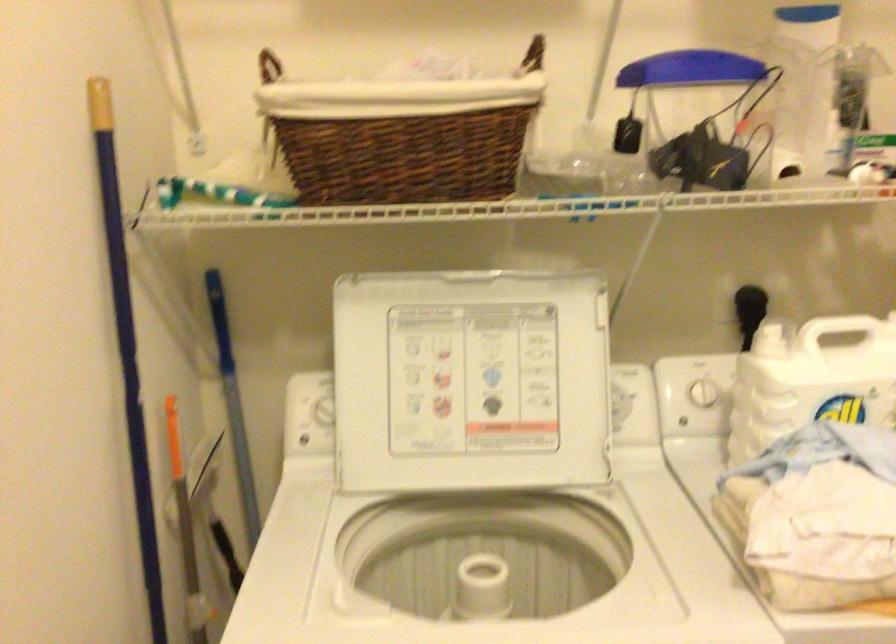
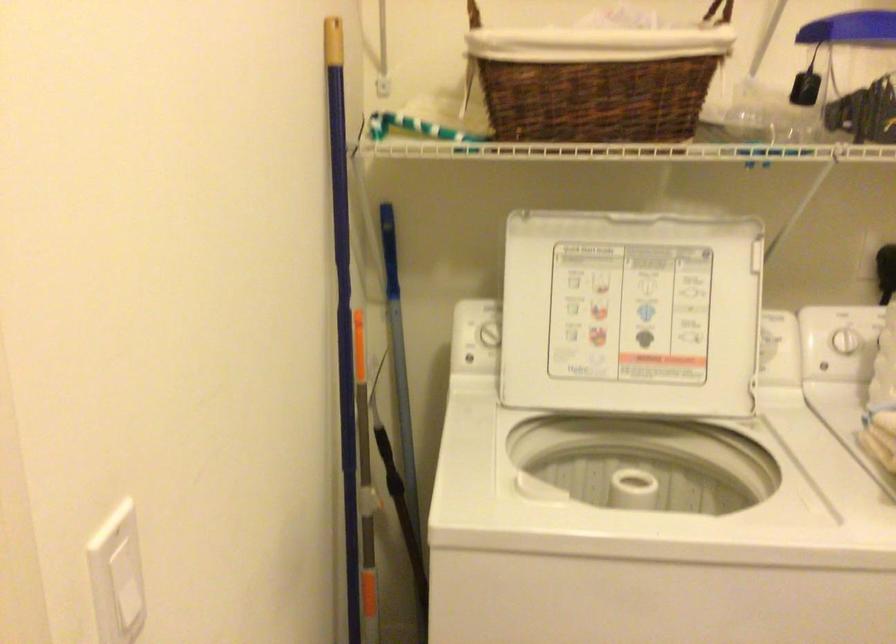
Where in the second image is the point corresponding to the point at 471,381 from the first image?

(631, 313)